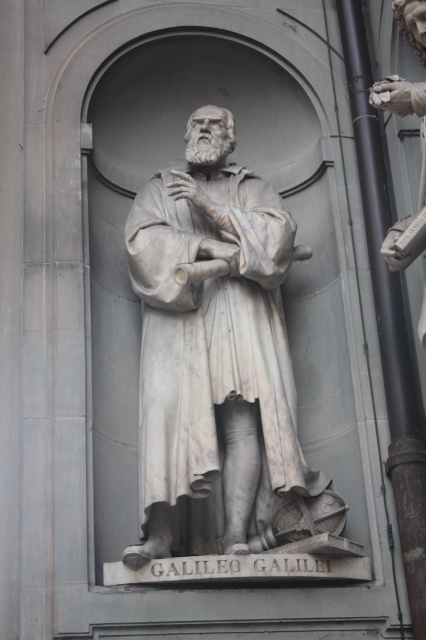
You are an art student standing in front of the white marble statue at center. Your task is to sketch the statue from the exact viewpoint where you are currently standing. To ensure accuracy, you need to determine the statue orientation relative to your position. Can you describe the statue orientation based on its coordinates point (213, 344)?

The white marble statue at center is represented by point (213, 344), which indicates its central position in the image. This means the statue is facing directly toward the viewer, positioned at the center of the scene, making it the focal point of the artwork.

You are an art conservator assessing the dimensions of the white marble statue at center and the polished bronze hand at upper right. Which object has a greater width?

The white marble statue at center has a greater width than the polished bronze hand at upper right.